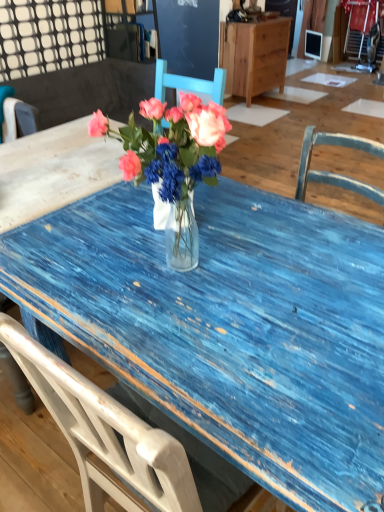
Question: In terms of size, does wooden cabinet at upper center appear bigger or smaller than matte glass vase at center?

Choices:
 (A) small
 (B) big

Answer: (B)

Question: From the image's perspective, is wooden cabinet at upper center located above or below matte glass vase at center?

Choices:
 (A) below
 (B) above

Answer: (B)

Question: Considering the real-world distances, which object is closest to the wooden cabinet at upper center?

Choices:
 (A) blue wooden chair at upper left, which is the second chair in left-to-right order
 (B) white wood chair at left, which is the 2th chair from right to left
 (C) matte glass vase at center

Answer: (A)

Question: Considering the real-world distances, which object is farthest from the blue wooden chair at upper left, which is the second chair in left-to-right order?

Choices:
 (A) white wood chair at left, which is the 2th chair from right to left
 (B) wooden cabinet at upper center
 (C) matte glass vase at center

Answer: (C)